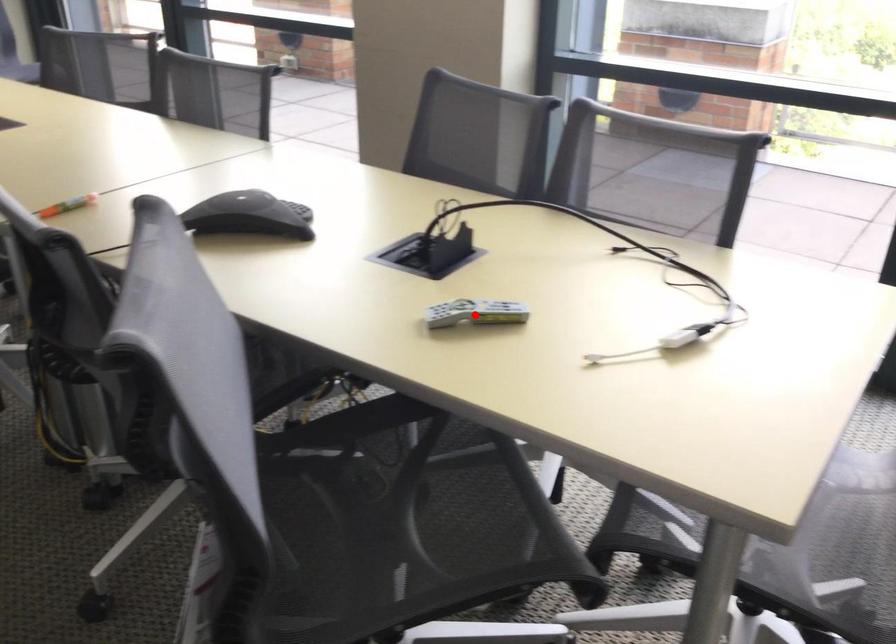
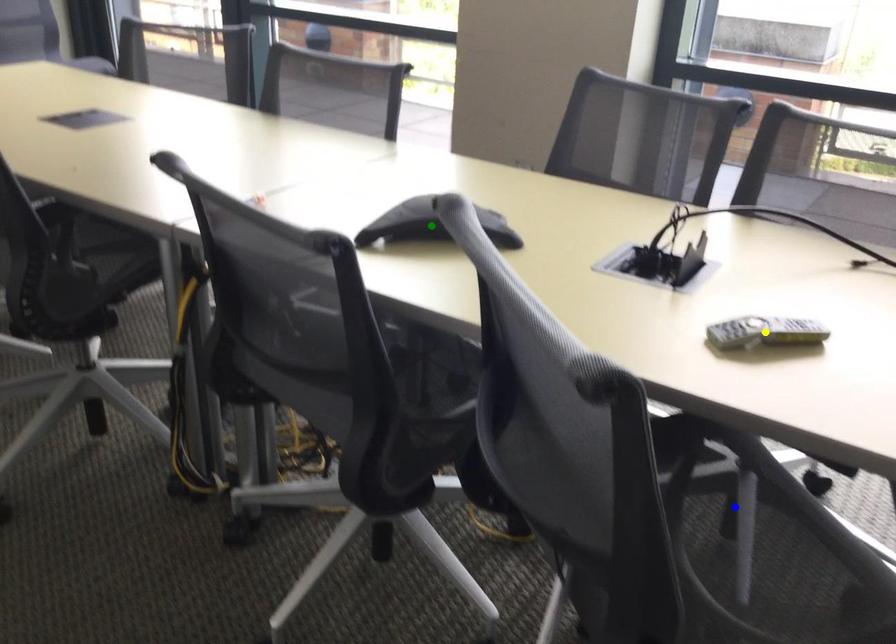
Question: I am providing you with two images of the same scene from different viewpoints. A red point is marked on the first image. You are given multiple points on the second image. Which point in image 2 represents the same 3d spot as the red point in image 1?

Choices:
 (A) blue point
 (B) yellow point
 (C) green point

Answer: (B)